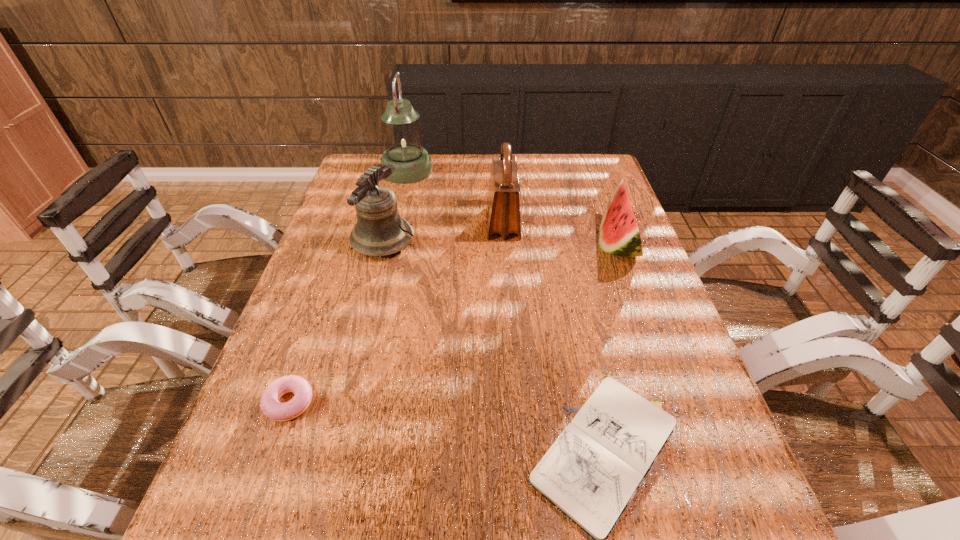
This screenshot has width=960, height=540. Identify the location of lantern. pyautogui.click(x=402, y=135).

The height and width of the screenshot is (540, 960). Identify the location of the tallest object. (402, 135).

Locate an element on the screen. shoulder bag is located at coordinates (503, 205).

Image resolution: width=960 pixels, height=540 pixels. Find the location of `bell`. bell is located at coordinates (379, 231).

Find the location of a particular element. watermelon is located at coordinates (619, 235).

Identify the location of the second shortest object. This screenshot has width=960, height=540. (271, 407).

Where is `blank space located on the front of the tallest object`? blank space located on the front of the tallest object is located at coordinates (396, 219).

You are a GUI agent. You are given a task and a screenshot of the screen. Output one action in this format:
    pyautogui.click(x=<x>, y=<y>)
    Task: Click on the free space located 0.280m on the front flap of the shoulder bag
    
    Given the screenshot: What is the action you would take?
    pyautogui.click(x=392, y=222)

Where is `vacant area situated 0.130m on the front flap of the shoulder bag`? Image resolution: width=960 pixels, height=540 pixels. vacant area situated 0.130m on the front flap of the shoulder bag is located at coordinates (442, 222).

Identify the location of vacant area situated 0.390m on the front flap of the shoulder bag. The height and width of the screenshot is (540, 960). (354, 222).